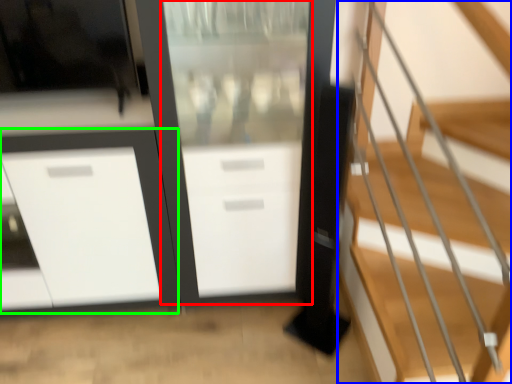
Question: Estimate the real-world distances between objects in this image. Which object is closer to screen door (highlighted by a red box), stairs (highlighted by a blue box) or cabinetry (highlighted by a green box)?

Choices:
 (A) stairs
 (B) cabinetry

Answer: (B)